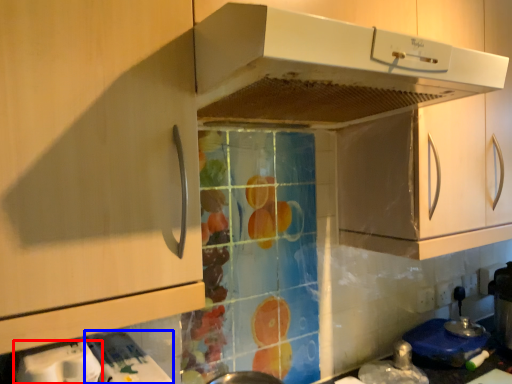
Question: Which object is closer to the camera taking this photo, appliance (highlighted by a red box) or appliance (highlighted by a blue box)?

Choices:
 (A) appliance
 (B) appliance

Answer: (A)